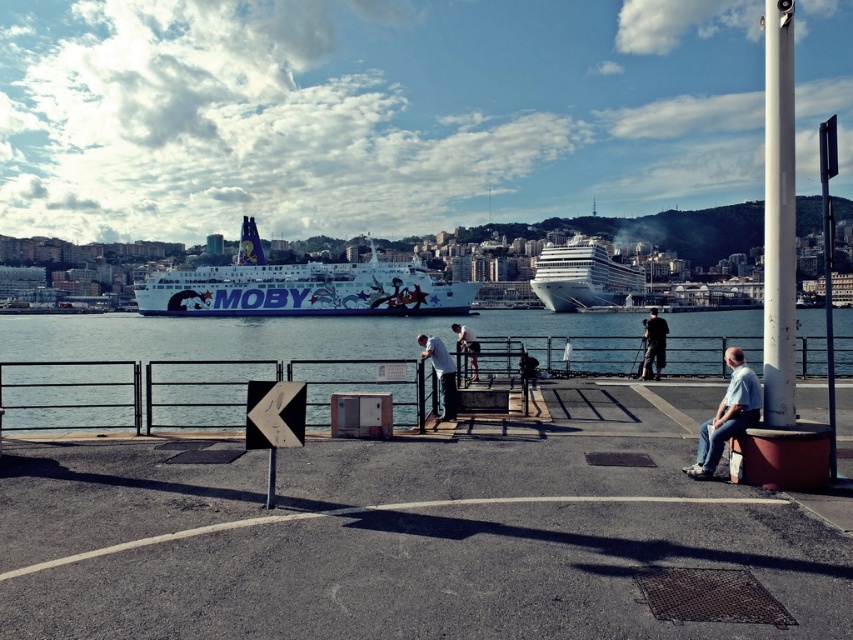
You are a photographer trying to capture the white glossy ferry at center and the dark gray pants at center in the same frame. Which object should you zoom out to include both in your photo?

Since the white glossy ferry at center is wider than the dark gray pants at center, you should zoom out to include both the white glossy ferry at center and the dark gray pants at center in the photo.

You are standing at the edge of the waterfront and see the white glossy ferry at center and the dark gray pants at center. If you want to reach the ferry first, which direction should you walk towards?

The white glossy ferry at center is 87.54 meters away from the dark gray pants at center. Since you want to reach the ferry first, you should walk towards the direction of the white glossy ferry at center.

You are standing on the waterfront and see the clear blue water at center and the white glossy cruise ship at center. Which object is located below the other?

The clear blue water at center is positioned under the white glossy cruise ship at center, so the clear blue water at center is below the white glossy cruise ship at center.